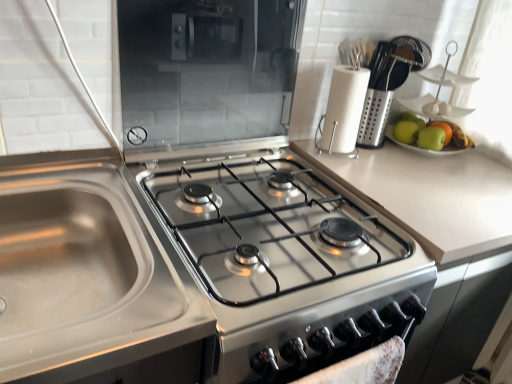
The height and width of the screenshot is (384, 512). What do you see at coordinates (268, 228) in the screenshot?
I see `stainless steel gas stove at center` at bounding box center [268, 228].

What is the approximate height of transparent glass microwave at upper center?

transparent glass microwave at upper center is 15.47 inches tall.

The image size is (512, 384). What do you see at coordinates (205, 74) in the screenshot?
I see `transparent glass microwave at upper center` at bounding box center [205, 74].

What do you see at coordinates (92, 283) in the screenshot? I see `stainless steel sink at lower left` at bounding box center [92, 283].

At what (x,y) coordinates should I click in order to perform the action: click on green matte apple at right, which is the 3th apple in left-to-right order. Please return your answer as a coordinate pair (x, y). Looking at the image, I should click on (453, 135).

Would you say green matte apple at upper right, which ranks as the third apple in right-to-left order, is inside or outside green matte apple at upper right, which appears as the second apple when viewed from the left?

green matte apple at upper right, which ranks as the third apple in right-to-left order, lies outside green matte apple at upper right, which appears as the second apple when viewed from the left.

Is the position of green matte apple at upper right, which ranks as the 1th apple in left-to-right order, less distant than that of green matte apple at upper right, which appears as the second apple when viewed from the left?

No, green matte apple at upper right, which ranks as the 1th apple in left-to-right order, is further to the viewer.

Does point (450, 150) appear closer or farther from the camera than point (234, 221)?

Clearly, point (450, 150) is more distant from the camera than point (234, 221).

Based on the photo, is green matte apple at right, which is the 3th apple in left-to-right order, placed right next to stainless steel gas stove at center?

No, green matte apple at right, which is the 3th apple in left-to-right order, is not beside stainless steel gas stove at center.

Which of these two, green matte apple at right, which is the 3th apple in left-to-right order, or stainless steel gas stove at center, is bigger?

Bigger between the two is stainless steel gas stove at center.

Is green matte apple at right, which is counted as the first apple, starting from the right, aimed at stainless steel gas stove at center?

No, green matte apple at right, which is counted as the first apple, starting from the right, is not facing towards stainless steel gas stove at center.

Is green matte apple at right, which is counted as the first apple, starting from the right, facing away from stainless steel sink at lower left?

That's not correct — green matte apple at right, which is counted as the first apple, starting from the right, is not looking away from stainless steel sink at lower left.

There is a stainless steel sink at lower left. Identify the location of the 2nd apple above it (from the image's perspective). (453, 135).

Is green matte apple at right, which is counted as the first apple, starting from the right, thinner than stainless steel sink at lower left?

Correct, the width of green matte apple at right, which is counted as the first apple, starting from the right, is less than that of stainless steel sink at lower left.

The height and width of the screenshot is (384, 512). I want to click on paper towel located on the left of green matte apple at upper right, which ranks as the 1th apple in left-to-right order, so click(x=343, y=111).

From the image's perspective, between white paper towel at upper right and green matte apple at upper right, which ranks as the 1th apple in left-to-right order, who is located below?

From the image's view, green matte apple at upper right, which ranks as the 1th apple in left-to-right order, is below.

Considering the sizes of white paper towel at upper right and green matte apple at upper right, which ranks as the 1th apple in left-to-right order, in the image, is white paper towel at upper right wider or thinner than green matte apple at upper right, which ranks as the 1th apple in left-to-right order,?

white paper towel at upper right is wider than green matte apple at upper right, which ranks as the 1th apple in left-to-right order.

Can you see green matte apple at upper right, which ranks as the third apple in right-to-left order, touching white paper towel at upper right?

No.

Considering the relative positions of green matte apple at upper right, which ranks as the 1th apple in left-to-right order, and white paper towel at upper right in the image provided, is green matte apple at upper right, which ranks as the 1th apple in left-to-right order, behind white paper towel at upper right?

Yes, green matte apple at upper right, which ranks as the 1th apple in left-to-right order, is further from the camera.

Considering the sizes of objects green matte apple at upper right, which ranks as the third apple in right-to-left order, and white paper towel at upper right in the image provided, who is taller, green matte apple at upper right, which ranks as the third apple in right-to-left order, or white paper towel at upper right?

Standing taller between the two is white paper towel at upper right.

Which of these two, green matte apple at upper right, which ranks as the 1th apple in left-to-right order, or white paper towel at upper right, is thinner?

green matte apple at upper right, which ranks as the 1th apple in left-to-right order.

From the image's perspective, which is below, transparent glass microwave at upper center or green matte apple at right, which is counted as the first apple, starting from the right?

green matte apple at right, which is counted as the first apple, starting from the right, from the image's perspective.

Is transparent glass microwave at upper center next to green matte apple at right, which is the 3th apple in left-to-right order, and touching it?

transparent glass microwave at upper center is not next to green matte apple at right, which is the 3th apple in left-to-right order, and they're not touching.

The height and width of the screenshot is (384, 512). There is a transparent glass microwave at upper center. What are the coordinates of `the 3rd apple below it (from a real-world perspective)` in the screenshot? It's located at 453,135.

Considering the sizes of objects transparent glass microwave at upper center and green matte apple at right, which is counted as the first apple, starting from the right, in the image provided, who is shorter, transparent glass microwave at upper center or green matte apple at right, which is counted as the first apple, starting from the right,?

With less height is green matte apple at right, which is counted as the first apple, starting from the right.

In terms of width, does stainless steel sink at lower left look wider or thinner when compared to transparent glass microwave at upper center?

Considering their sizes, stainless steel sink at lower left looks broader than transparent glass microwave at upper center.

I want to click on appliance behind the stainless steel sink at lower left, so click(205, 74).

Is point (132, 339) farther from camera compared to point (211, 7)?

No, (132, 339) is closer to viewer.

Is stainless steel sink at lower left shorter than transparent glass microwave at upper center?

No.

Where is `the 2nd apple positioned above the green matte apple at upper right, acting as the 2th apple starting from the right (from the image's perspective)`? The image size is (512, 384). the 2nd apple positioned above the green matte apple at upper right, acting as the 2th apple starting from the right (from the image's perspective) is located at coordinates (406, 132).

Where is `apple that is the 3rd one when counting rightward from the stainless steel gas stove at center`? Image resolution: width=512 pixels, height=384 pixels. apple that is the 3rd one when counting rightward from the stainless steel gas stove at center is located at coordinates (453, 135).

From the image, which object appears to be farther from stainless steel gas stove at center, transparent glass microwave at upper center or stainless steel sink at lower left?

transparent glass microwave at upper center.

Estimate the real-world distances between objects in this image. Which object is closer to green matte apple at right, which is counted as the first apple, starting from the right, stainless steel sink at lower left or green matte apple at upper right, which ranks as the 1th apple in left-to-right order?

green matte apple at upper right, which ranks as the 1th apple in left-to-right order, is closer to green matte apple at right, which is counted as the first apple, starting from the right.

From the image, which object appears to be farther from green matte apple at upper right, which ranks as the 1th apple in left-to-right order, transparent glass microwave at upper center or green matte apple at upper right, acting as the 2th apple starting from the right?

transparent glass microwave at upper center lies further to green matte apple at upper right, which ranks as the 1th apple in left-to-right order, than the other object.

When comparing their distances from green matte apple at upper right, which appears as the second apple when viewed from the left, does stainless steel gas stove at center or transparent glass microwave at upper center seem further?

stainless steel gas stove at center is positioned further to the anchor green matte apple at upper right, which appears as the second apple when viewed from the left.

Consider the image. When comparing their distances from stainless steel gas stove at center, does transparent glass microwave at upper center or white paper towel at upper right seem closer?

Based on the image, transparent glass microwave at upper center appears to be nearer to stainless steel gas stove at center.

Which object lies nearer to the anchor point stainless steel gas stove at center, green matte apple at right, which is counted as the first apple, starting from the right, or stainless steel sink at lower left?

stainless steel sink at lower left lies closer to stainless steel gas stove at center than the other object.

Considering their positions, is green matte apple at upper right, which ranks as the third apple in right-to-left order, positioned closer to white paper towel at upper right than stainless steel sink at lower left?

Among the two, green matte apple at upper right, which ranks as the third apple in right-to-left order, is located nearer to white paper towel at upper right.

Estimate the real-world distances between objects in this image. Which object is closer to stainless steel sink at lower left, green matte apple at upper right, which appears as the second apple when viewed from the left, or green matte apple at upper right, which ranks as the 1th apple in left-to-right order?

Based on the image, green matte apple at upper right, which ranks as the 1th apple in left-to-right order, appears to be nearer to stainless steel sink at lower left.

Image resolution: width=512 pixels, height=384 pixels. Find the location of `gas stove situated between stainless steel sink at lower left and green matte apple at upper right, which ranks as the 1th apple in left-to-right order, from left to right`. gas stove situated between stainless steel sink at lower left and green matte apple at upper right, which ranks as the 1th apple in left-to-right order, from left to right is located at coordinates (268, 228).

Where is `apple between transparent glass microwave at upper center and green matte apple at upper right, which appears as the second apple when viewed from the left`? apple between transparent glass microwave at upper center and green matte apple at upper right, which appears as the second apple when viewed from the left is located at coordinates (406, 132).

Locate an element on the screen. This screenshot has width=512, height=384. apple situated between stainless steel sink at lower left and green matte apple at upper right, acting as the 2th apple starting from the right, from left to right is located at coordinates (406, 132).

Locate an element on the screen. This screenshot has width=512, height=384. gas stove between transparent glass microwave at upper center and stainless steel sink at lower left in the up-down direction is located at coordinates (268, 228).